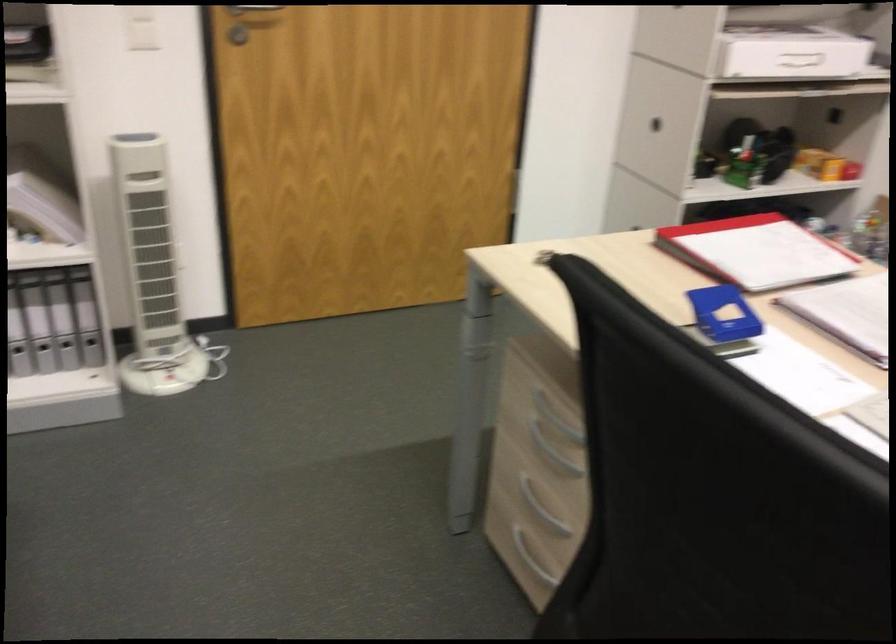
Where is `blue hole punch`? This screenshot has width=896, height=644. blue hole punch is located at coordinates (722, 314).